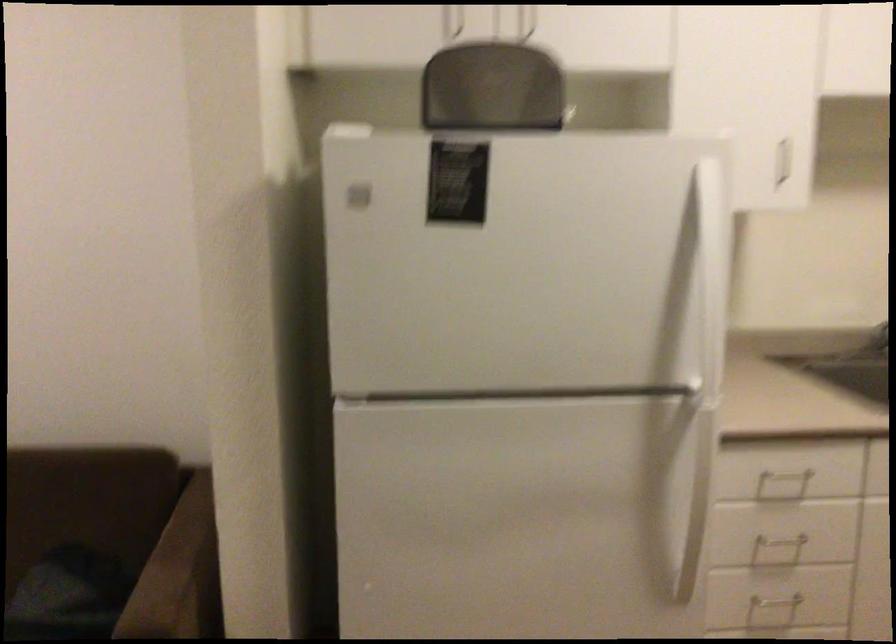
Where is `white cabinet handle`? Image resolution: width=896 pixels, height=644 pixels. white cabinet handle is located at coordinates (785, 160).